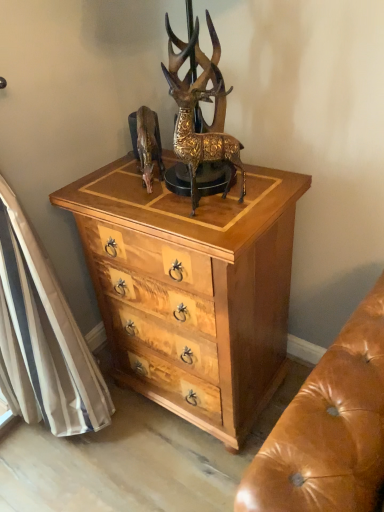
Find the location of a particular element. vacant position to the left of shiny brown deer at center is located at coordinates (109, 186).